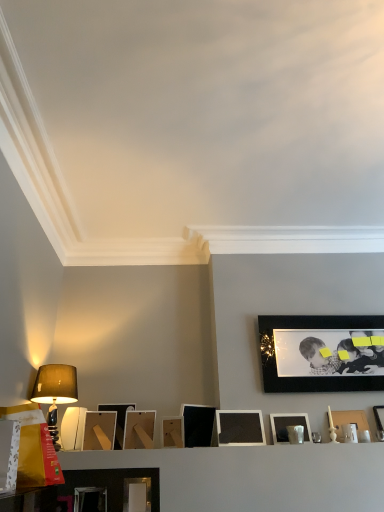
Question: Could you tell me if matte brown picture frame at lower center, which is the third picture frame from left to right, is turned towards matte wooden picture frame at center, which ranks as the fifth picture frame in left-to-right order?

Choices:
 (A) yes
 (B) no

Answer: (B)

Question: From the image's perspective, would you say matte brown picture frame at lower center, which is the third picture frame from left to right, is positioned over matte wooden picture frame at center, which is the 9th picture frame from right to left?

Choices:
 (A) yes
 (B) no

Answer: (A)

Question: Is matte brown picture frame at lower center, which appears as the 11th picture frame when viewed from the right, further to the viewer compared to matte wooden picture frame at center, which ranks as the fifth picture frame in left-to-right order?

Choices:
 (A) no
 (B) yes

Answer: (A)

Question: Can you confirm if matte brown picture frame at lower center, which is the third picture frame from left to right, is thinner than matte wooden picture frame at center, which is the 9th picture frame from right to left?

Choices:
 (A) no
 (B) yes

Answer: (A)

Question: Is matte brown picture frame at lower center, which is the third picture frame from left to right, next to matte wooden picture frame at center, which ranks as the fifth picture frame in left-to-right order?

Choices:
 (A) yes
 (B) no

Answer: (B)

Question: Is matte brown picture frame at lower center, which is the third picture frame from left to right, bigger or smaller than matte silver picture frame at lower center, which ranks as the 6th picture frame in left-to-right order?

Choices:
 (A) small
 (B) big

Answer: (B)

Question: Is matte brown picture frame at lower center, which is the third picture frame from left to right, inside or outside of matte silver picture frame at lower center, which ranks as the 6th picture frame in left-to-right order?

Choices:
 (A) outside
 (B) inside

Answer: (A)

Question: From the image's perspective, relative to matte silver picture frame at lower center, which ranks as the 6th picture frame in left-to-right order, is matte brown picture frame at lower center, which appears as the 11th picture frame when viewed from the right, above or below?

Choices:
 (A) above
 (B) below

Answer: (A)

Question: Considering the positions of matte brown picture frame at lower center, which appears as the 11th picture frame when viewed from the right, and matte silver picture frame at lower center, the eighth picture frame from the right, in the image, is matte brown picture frame at lower center, which appears as the 11th picture frame when viewed from the right, wider or thinner than matte silver picture frame at lower center, the eighth picture frame from the right,?

Choices:
 (A) wide
 (B) thin

Answer: (A)

Question: Looking at the image, does matte black picture frame at center, which ranks as the fourth picture frame in right-to-left order, seem bigger or smaller compared to matte black picture frame at right, the first picture frame from the right?

Choices:
 (A) big
 (B) small

Answer: (A)

Question: Considering the positions of matte black picture frame at center, which ranks as the fourth picture frame in right-to-left order, and matte black picture frame at right, the first picture frame from the right, in the image, is matte black picture frame at center, which ranks as the fourth picture frame in right-to-left order, wider or thinner than matte black picture frame at right, the first picture frame from the right,?

Choices:
 (A) thin
 (B) wide

Answer: (A)

Question: From a real-world perspective, is matte black picture frame at center, which ranks as the fourth picture frame in right-to-left order, physically located above or below matte black picture frame at right, which ranks as the 13th picture frame in left-to-right order?

Choices:
 (A) below
 (B) above

Answer: (A)

Question: Which is correct: matte black picture frame at center, which appears as the tenth picture frame when viewed from the left, is inside matte black picture frame at right, which ranks as the 13th picture frame in left-to-right order, or outside of it?

Choices:
 (A) inside
 (B) outside

Answer: (B)

Question: Considering the positions of matte wooden picture frame at center, arranged as the seventh picture frame when viewed from the right, and black matte picture frame at upper right, the 11th picture frame in the left-to-right sequence, in the image, is matte wooden picture frame at center, arranged as the seventh picture frame when viewed from the right, taller or shorter than black matte picture frame at upper right, the 11th picture frame in the left-to-right sequence,?

Choices:
 (A) short
 (B) tall

Answer: (A)

Question: In the image, is matte wooden picture frame at center, the 7th picture frame when ordered from left to right, positioned in front of or behind black matte picture frame at upper right, arranged as the 3th picture frame when viewed from the right?

Choices:
 (A) behind
 (B) front

Answer: (B)